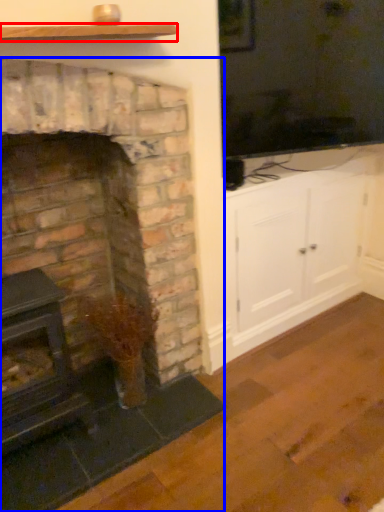
Question: Which object appears farthest to the camera in this image, shelf (highlighted by a red box) or fireplace (highlighted by a blue box)?

Choices:
 (A) shelf
 (B) fireplace

Answer: (A)